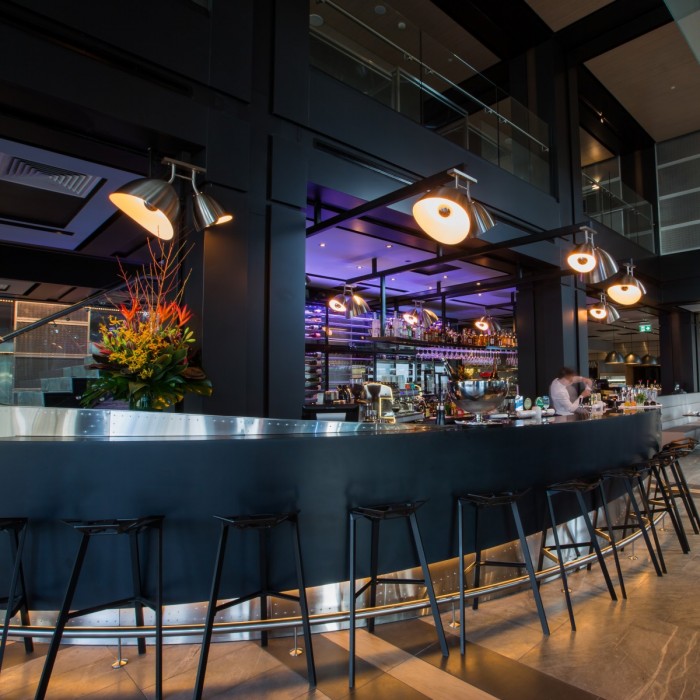
In order to click on barstools in this screenshot , I will do `click(112, 484)`, `click(262, 476)`, `click(388, 470)`, `click(494, 462)`, `click(575, 456)`, `click(645, 449)`.